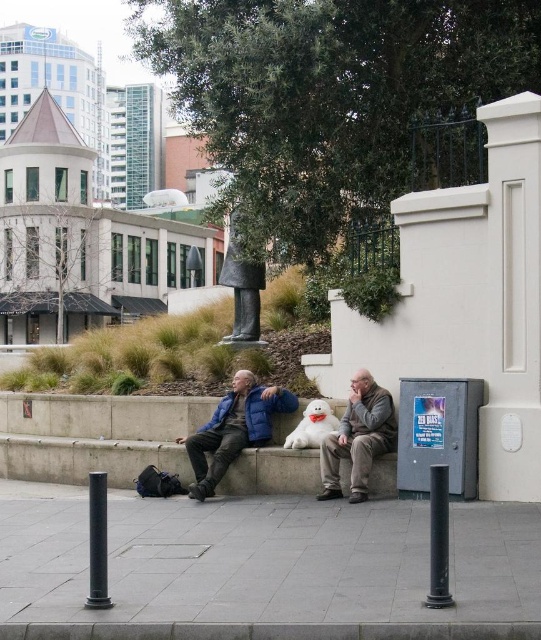
Between matte blue jacket at center and gray woolen sweater at center, which one is positioned lower?

matte blue jacket at center is below.

Is matte blue jacket at center below gray woolen sweater at center?

Correct, matte blue jacket at center is located below gray woolen sweater at center.

Locate an element on the screen. matte blue jacket at center is located at coordinates (234, 429).

Is point (359, 472) positioned after point (265, 278)?

No, (359, 472) is in front of (265, 278).

Is the position of matte blue jacket at center more distant than that of dark gray stone statue at center?

No, it is in front of dark gray stone statue at center.

Is point (286, 412) positioned after point (247, 296)?

No, it is not.

You are a GUI agent. You are given a task and a screenshot of the screen. Output one action in this format:
    pyautogui.click(x=<x>, y=<y>)
    Task: Click on the matte blue jacket at center
    
    Given the screenshot: What is the action you would take?
    pyautogui.click(x=234, y=429)

Is gray concrete pavement at lower center bigger than gray woolen sweater at center?

No, gray concrete pavement at lower center is not bigger than gray woolen sweater at center.

Does gray concrete pavement at lower center appear on the right side of gray woolen sweater at center?

Correct, you'll find gray concrete pavement at lower center to the right of gray woolen sweater at center.

Locate an element on the screen. gray concrete pavement at lower center is located at coordinates (265, 566).

Locate an element on the screen. gray concrete pavement at lower center is located at coordinates (265, 566).